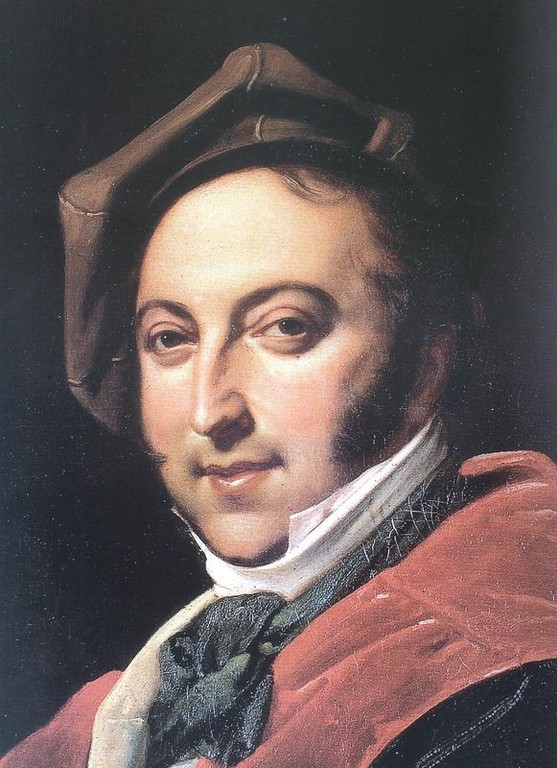
Image resolution: width=557 pixels, height=768 pixels. In order to click on painting in this screenshot , I will do `click(78, 518)`.